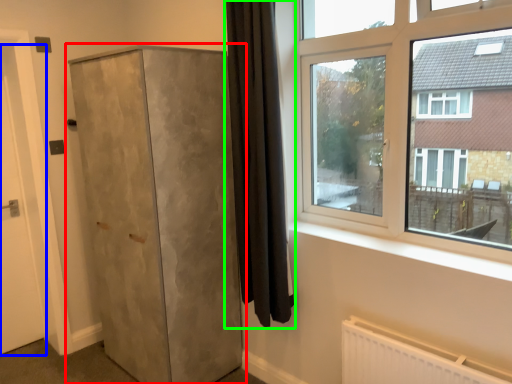
Question: Based on their relative distances, which object is farther from cupboard (highlighted by a red box)? Choose from door (highlighted by a blue box) and curtain (highlighted by a green box).

Choices:
 (A) door
 (B) curtain

Answer: (A)